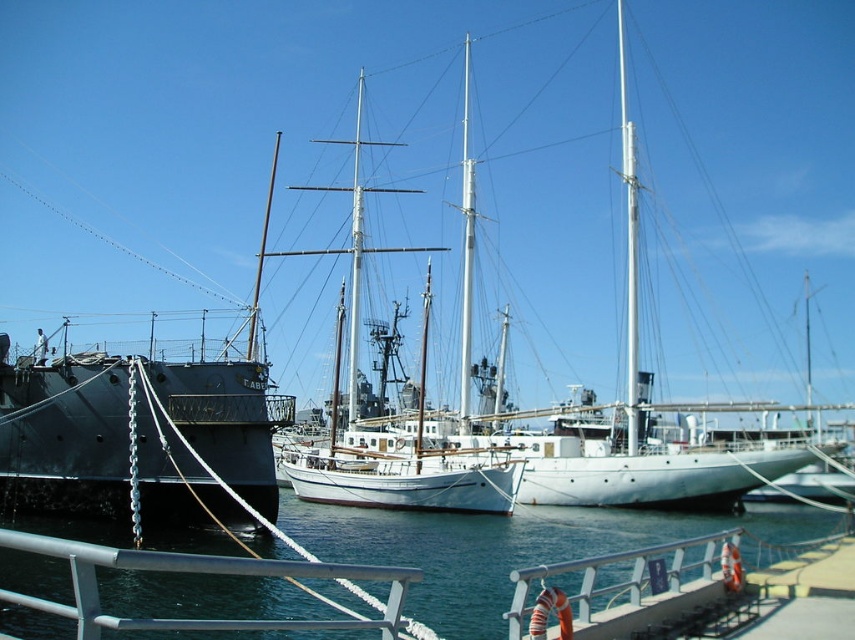
You are a photographer planning to take a photo of the white matte sailboat at center and the clear blue water at center. Based on the scene, which object is positioned closer to the camera?

The white matte sailboat at center is closer to the camera than the clear blue water at center, which is behind it.

Looking at this image, you are standing on the pier and want to take a photo of both the clear blue water at center and the matte black ship at left. Which object will appear larger in your photo?

The clear blue water at center will appear larger in the photo because it is closer to the viewer than the matte black ship at left.

Based on the photo, you are standing on the pier and want to reach the point marked at coordinates point (x=66, y=627). The pier is 150 feet long. Can you walk to that point from your current position?

The point marked at coordinates point (x=66, y=627) is 155.69 feet away from the viewer. Since the pier is only 150 feet long, you cannot walk to that point from your current position as it extends beyond the pier length.